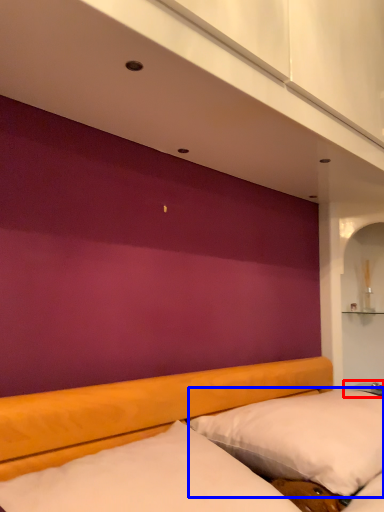
Question: Which object appears farthest to the camera in this image, table (highlighted by a red box) or pillow (highlighted by a blue box)?

Choices:
 (A) table
 (B) pillow

Answer: (A)